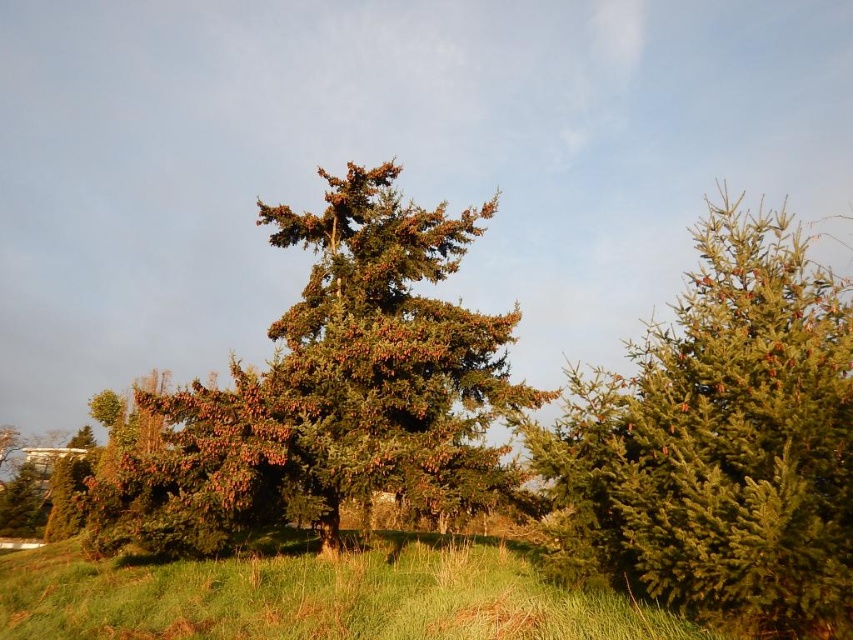
Question: Can you confirm if green matte evergreen tree at right is smaller than green textured tree at center?

Choices:
 (A) no
 (B) yes

Answer: (A)

Question: Is the position of green textured tree at center less distant than that of green grass at center?

Choices:
 (A) yes
 (B) no

Answer: (B)

Question: Estimate the real-world distances between objects in this image. Which object is farther from the green textured tree at center?

Choices:
 (A) green matte evergreen tree at right
 (B) green grass at center

Answer: (A)

Question: Does green textured tree at center appear on the left side of green grass at center?

Choices:
 (A) yes
 (B) no

Answer: (B)

Question: Which of the following is the closest to the observer?

Choices:
 (A) green matte evergreen tree at right
 (B) green textured tree at center

Answer: (A)

Question: Among these objects, which one is farthest from the camera?

Choices:
 (A) green grass at center
 (B) green textured tree at center
 (C) green matte evergreen tree at right

Answer: (B)